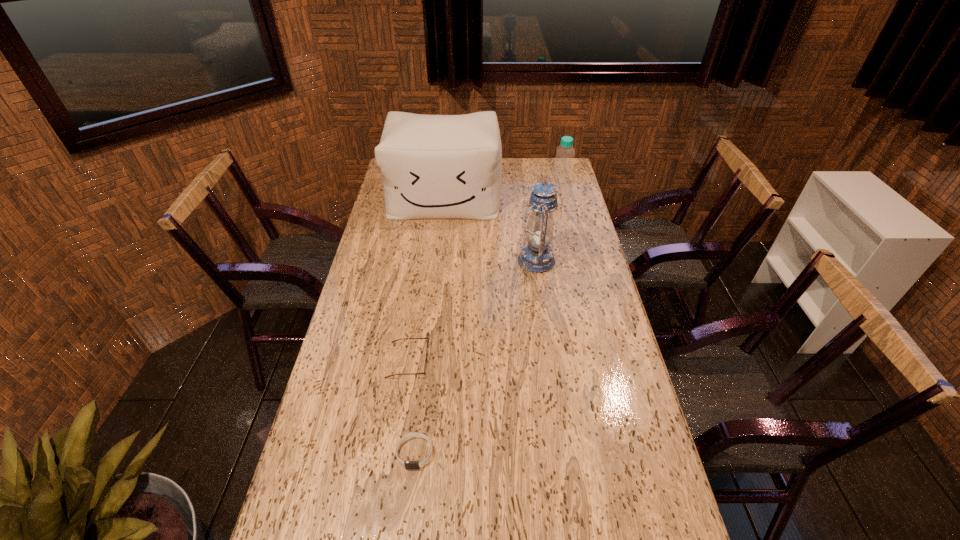
This screenshot has height=540, width=960. I want to click on cushion, so click(432, 166).

I want to click on lantern, so click(536, 256).

Image resolution: width=960 pixels, height=540 pixels. Identify the location of the fourth object from left to right. (536, 256).

Identify the location of the rightmost object. (563, 167).

The width and height of the screenshot is (960, 540). Find the location of `bottle`. bottle is located at coordinates (563, 167).

Locate an element on the screen. The width and height of the screenshot is (960, 540). the nearest object is located at coordinates (408, 464).

You are a GUI agent. You are given a task and a screenshot of the screen. Output one action in this format:
    pyautogui.click(x=<x>, y=<y>)
    Task: Click on the spectacles
    Image resolution: width=960 pixels, height=540 pixels.
    Given the screenshot: What is the action you would take?
    pyautogui.click(x=427, y=338)

Find the location of a particular element. Image resolution: width=960 pixels, height=540 pixels. free space located 0.050m on the side of the cushion with the smiley face is located at coordinates (441, 230).

Identify the location of free point located 0.240m on the front-facing side of the lantern. (454, 260).

The height and width of the screenshot is (540, 960). I want to click on vacant area situated on the front-facing side of the lantern, so click(x=499, y=260).